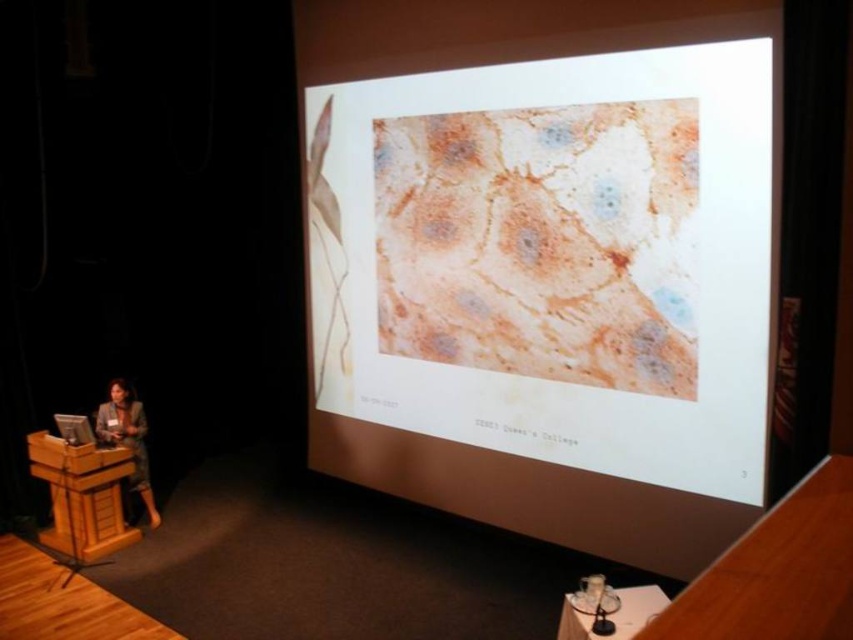
You are an attendee at the presentation. You need to reach the remote control that the woman is holding. To do so, you have to walk around the wooden podium at lower left and the matte black suit at lower left. Which object should you go around first to reach the remote control?

The wooden podium at lower left is shorter than matte black suit at lower left. Therefore, you should go around the wooden podium at lower left first since it is shorter and less obstructive, allowing easier access to the remote control.

You are an event organizer setting up the presentation room. You need to place a 1.5 meter tall decorative plant between the wooden podium at lower left and the matte black suit at lower left. Can both objects accommodate the plant without overlapping?

The wooden podium at lower left has a larger size compared to matte black suit at lower left. Since the wooden podium at lower left is bigger, there is enough space between them to place the 1.5 meter tall decorative plant without overlapping.

You are an attendee at this presentation and want to see both the speaker and the slide. Since the screen is on the right and the podium is on the left, where should you stand to ensure you can see both the wooden podium at lower left and the matte paper slide at center?

You should stand to the right side of the room because the matte paper slide at center is positioned over the wooden podium at lower left, so standing to the right would allow you to see both the speaker at the wooden podium at lower left and the matte paper slide at center displayed on the screen.